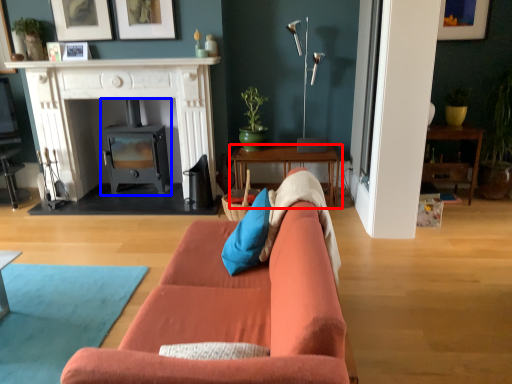
Question: Which point is further to the camera, table (highlighted by a red box) or wood burning stove (highlighted by a blue box)?

Choices:
 (A) table
 (B) wood burning stove

Answer: (B)